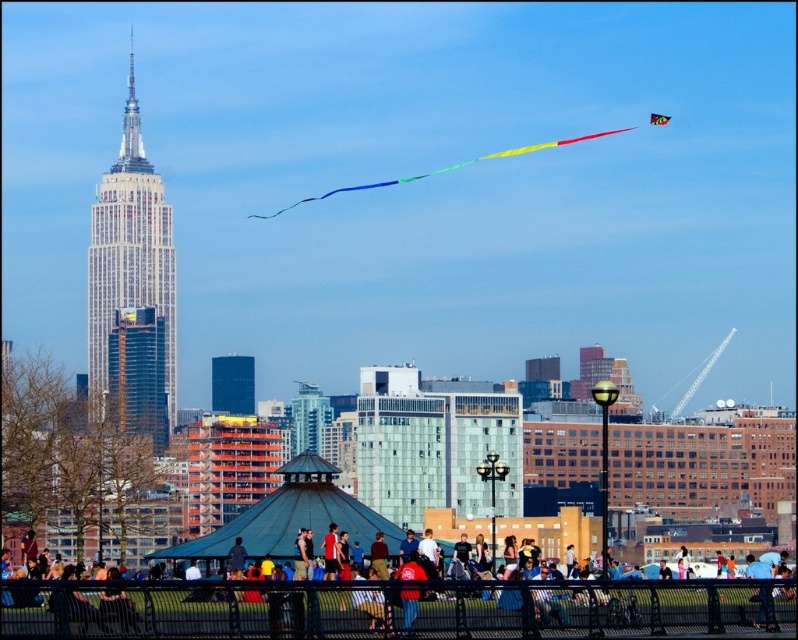
Is multicolored fabric crowd at center shorter than multicolored fabric kite at upper right?

No.

Does multicolored fabric crowd at center come behind multicolored fabric kite at upper right?

No.

Does point (453, 600) come farther from viewer compared to point (650, 122)?

No, (453, 600) is closer to viewer.

The image size is (798, 640). Identify the location of multicolored fabric crowd at center. (394, 605).

Is multicolored fabric crowd at center to the left of rainbow fabric kite at upper center from the viewer's perspective?

Correct, you'll find multicolored fabric crowd at center to the left of rainbow fabric kite at upper center.

Can you confirm if multicolored fabric crowd at center is wider than rainbow fabric kite at upper center?

Correct, the width of multicolored fabric crowd at center exceeds that of rainbow fabric kite at upper center.

The image size is (798, 640). Find the location of `multicolored fabric crowd at center`. multicolored fabric crowd at center is located at coordinates pyautogui.click(x=394, y=605).

Can you confirm if rainbow fabric kite at upper center is bigger than multicolored fabric kite at upper right?

Yes, rainbow fabric kite at upper center is bigger than multicolored fabric kite at upper right.

Which is more to the left, rainbow fabric kite at upper center or multicolored fabric kite at upper right?

Positioned to the left is rainbow fabric kite at upper center.

Is point (567, 144) positioned behind point (654, 124)?

No, it is in front of (654, 124).

Locate an element on the screen. Image resolution: width=798 pixels, height=640 pixels. rainbow fabric kite at upper center is located at coordinates click(445, 168).